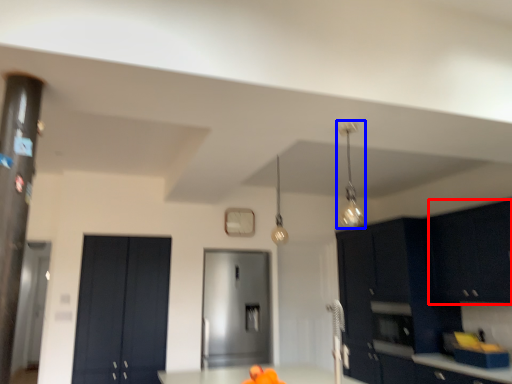
Question: Among these objects, which one is nearest to the camera, cabinetry (highlighted by a red box) or light fixture (highlighted by a blue box)?

Choices:
 (A) cabinetry
 (B) light fixture

Answer: (B)